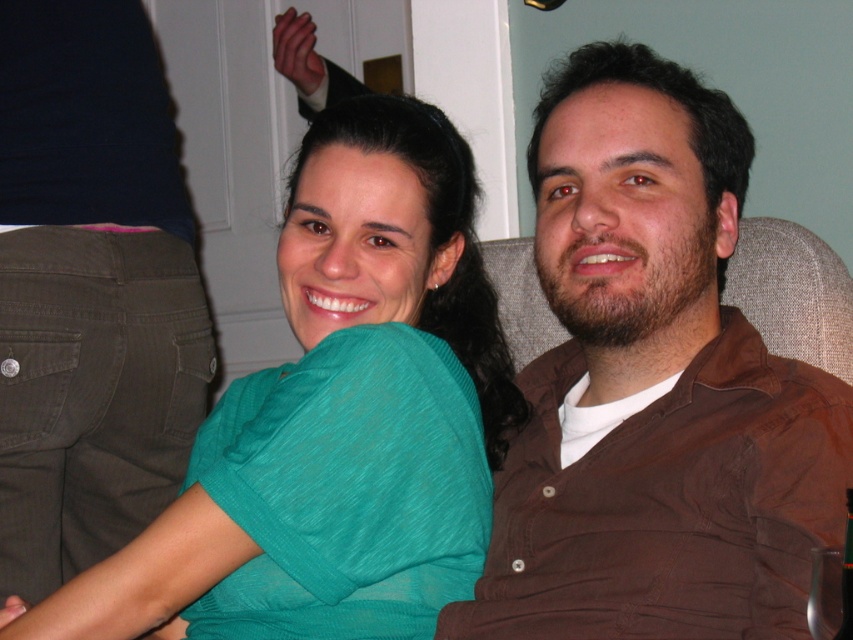
Question: Is teal jersey at center in front of brown fabric swivel chair at right?

Choices:
 (A) no
 (B) yes

Answer: (B)

Question: Among these objects, which one is farthest from the camera?

Choices:
 (A) brown cotton shirt at center
 (B) dark green cotton pants at lower left

Answer: (B)

Question: Which point is farther from the camera taking this photo?

Choices:
 (A) (824, 332)
 (B) (825, 468)

Answer: (A)

Question: Based on their relative distances, which object is farther from the brown cotton shirt at center?

Choices:
 (A) dark green cotton pants at lower left
 (B) teal jersey at center

Answer: (A)

Question: In this image, where is brown cotton shirt at center located relative to dark green cotton pants at lower left?

Choices:
 (A) above
 (B) below

Answer: (B)

Question: Is teal jersey at center positioned behind dark green cotton pants at lower left?

Choices:
 (A) yes
 (B) no

Answer: (B)